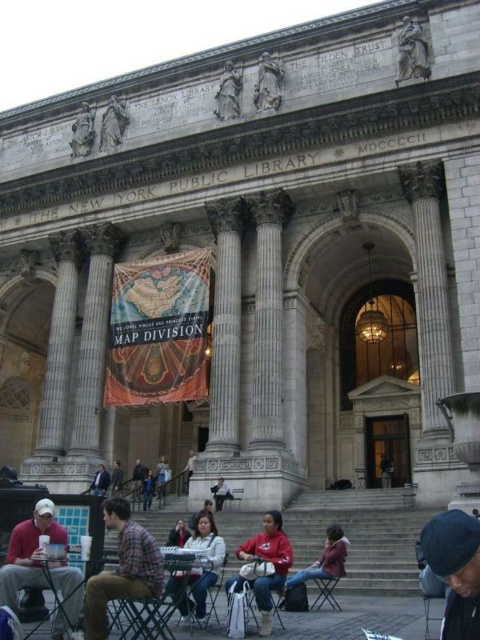
Question: Does white marble pillar at center lie behind plaid flannel shirt at lower left?

Choices:
 (A) no
 (B) yes

Answer: (B)

Question: Among these points, which one is nearest to the camera?

Choices:
 (A) (273, 573)
 (B) (337, 609)

Answer: (A)

Question: Is white matte jacket at center further to the viewer compared to metallic silver chair at center?

Choices:
 (A) no
 (B) yes

Answer: (A)

Question: Estimate the real-world distances between objects in this image. Which object is farther from the metallic silver chair at lower center?

Choices:
 (A) white cotton shirt at center
 (B) metallic folding chair at lower center
 (C) stone statue at upper center

Answer: (C)

Question: Which object appears closest to the camera in this image?

Choices:
 (A) white marble column at center
 (B) red jacket at center
 (C) white marble pillar at left
 (D) wooden chair at center

Answer: (B)

Question: From the image, what is the correct spatial relationship of matte red jacket at center in relation to metallic silver chair at center?

Choices:
 (A) below
 (B) above

Answer: (B)